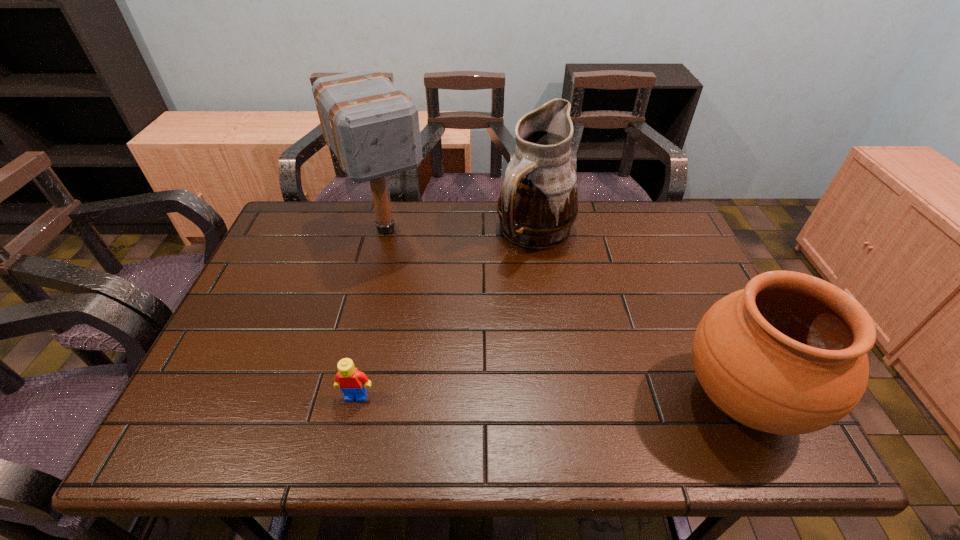
Locate an element on the screen. free location located 0.380m on the striking surface of the mallet is located at coordinates (461, 354).

Where is `vacant area located on the striking surface of the mallet`? vacant area located on the striking surface of the mallet is located at coordinates (427, 300).

Find the location of `free location located on the striking surface of the mallet`. free location located on the striking surface of the mallet is located at coordinates (442, 322).

At what (x,y) coordinates should I click in order to perform the action: click on pitcher at the far edge. Please return your answer as a coordinate pair (x, y). This screenshot has width=960, height=540. Looking at the image, I should click on (538, 203).

Where is `mallet at the far edge`? mallet at the far edge is located at coordinates (373, 128).

What are the coordinates of `Lego at the near edge` in the screenshot? It's located at (351, 381).

Identify the location of pottery that is at the near edge. This screenshot has width=960, height=540. (787, 355).

The height and width of the screenshot is (540, 960). I want to click on object located at the right edge, so click(x=787, y=355).

Where is `object located in the near right corner section of the desktop`? The image size is (960, 540). object located in the near right corner section of the desktop is located at coordinates (787, 355).

At what (x,y) coordinates should I click in order to perform the action: click on blank space at the far edge. Please return your answer as a coordinate pair (x, y). Looking at the image, I should click on (436, 216).